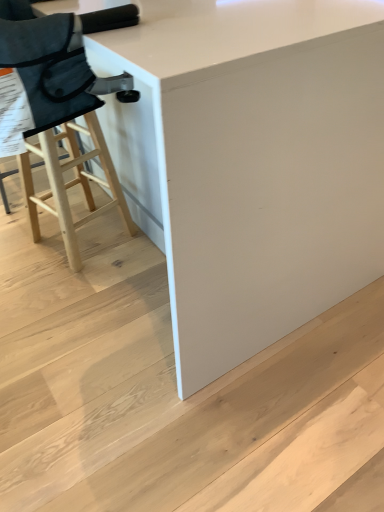
At what (x,y) coordinates should I click in order to perform the action: click on free location to the right of natural wood stool at left. Please return your answer as a coordinate pair (x, y). The height and width of the screenshot is (512, 384). Looking at the image, I should click on (135, 252).